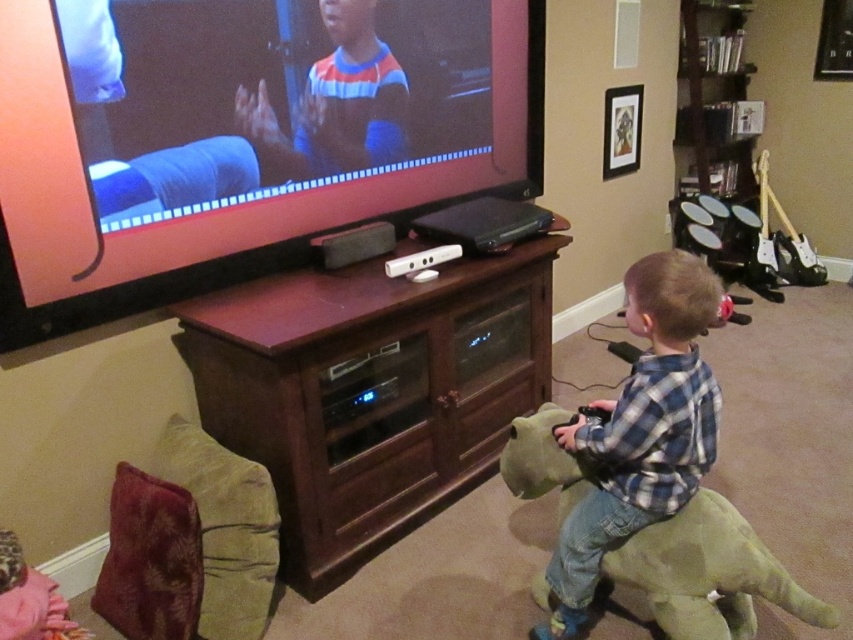
Question: Considering the real-world distances, which object is farthest from the blue plaid shirt at lower right?

Choices:
 (A) brown wood entertainment center at center
 (B) green plush dinosaur at lower right

Answer: (A)

Question: Which of the following is the farthest from the observer?

Choices:
 (A) (711, 632)
 (B) (335, 285)

Answer: (B)

Question: Based on their relative distances, which object is nearer to the brown wood entertainment center at center?

Choices:
 (A) green plush dinosaur at lower right
 (B) blue plaid shirt at lower right

Answer: (A)

Question: Does brown wood entertainment center at center have a lesser width compared to green plush dinosaur at lower right?

Choices:
 (A) yes
 (B) no

Answer: (B)

Question: Is the position of brown wood entertainment center at center less distant than that of blue plaid shirt at lower right?

Choices:
 (A) no
 (B) yes

Answer: (A)

Question: Can you confirm if brown wood entertainment center at center is wider than green plush dinosaur at lower right?

Choices:
 (A) yes
 (B) no

Answer: (A)